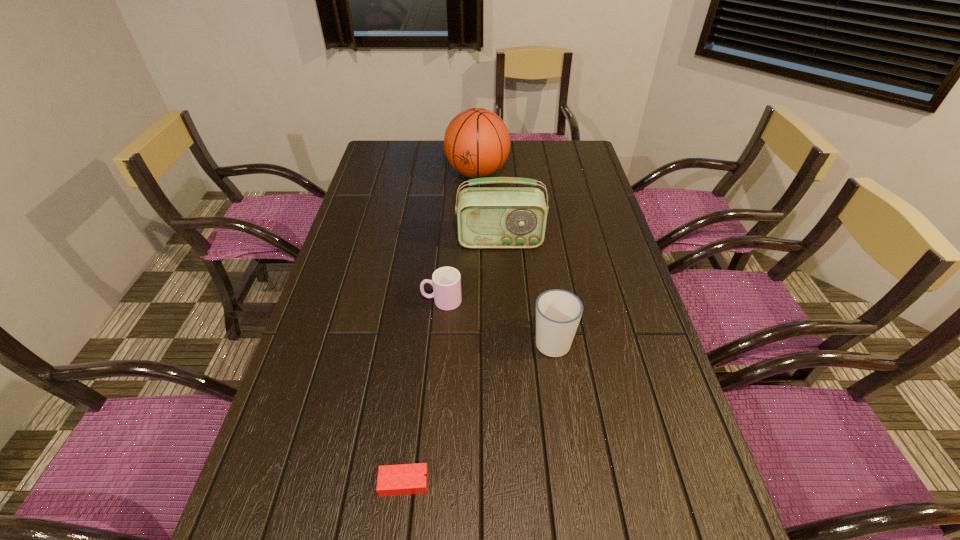
You are a GUI agent. You are given a task and a screenshot of the screen. Output one action in this format:
    pyautogui.click(x=<x>, y=<y>)
    Task: Click on the vacant space located with a handle on the side of the nearer cup
    The image size is (960, 540).
    Given the screenshot: What is the action you would take?
    pyautogui.click(x=538, y=242)

Image resolution: width=960 pixels, height=540 pixels. In order to click on vacant region located 0.300m with a handle on the side of the nearer cup in this screenshot , I will do `click(539, 248)`.

This screenshot has height=540, width=960. I want to click on vacant area situated 0.400m with a handle on the side of the nearer cup, so click(536, 229).

Locate an element on the screen. The width and height of the screenshot is (960, 540). vacant space situated 0.080m with the handle on the side of the shorter cup is located at coordinates (393, 301).

Find the location of a particular element. free space located with the handle on the side of the shorter cup is located at coordinates (400, 301).

Locate an element on the screen. This screenshot has width=960, height=540. vacant region located with the handle on the side of the shorter cup is located at coordinates (393, 301).

Image resolution: width=960 pixels, height=540 pixels. Identify the location of vacant region located on the left of the Lego. (269, 483).

You are a GUI agent. You are given a task and a screenshot of the screen. Output one action in this format:
    pyautogui.click(x=<x>, y=<y>)
    Task: Click on the object situated at the far edge
    The image size is (960, 540).
    Given the screenshot: What is the action you would take?
    pyautogui.click(x=477, y=143)

In the image, there is a desktop. Where is `blank space at the far edge`? The width and height of the screenshot is (960, 540). blank space at the far edge is located at coordinates (539, 143).

This screenshot has width=960, height=540. Identify the location of vacant point at the left edge. (319, 447).